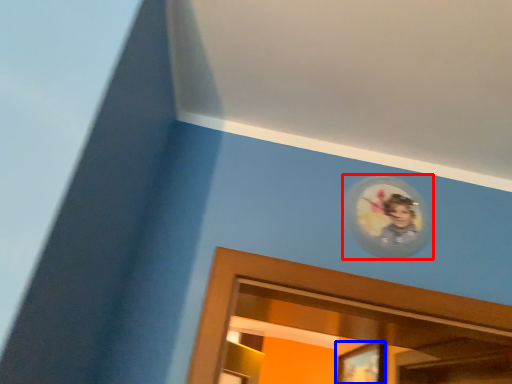
Question: Which object appears closest to the camera in this image, picture frame (highlighted by a red box) or portrait (highlighted by a blue box)?

Choices:
 (A) picture frame
 (B) portrait

Answer: (A)